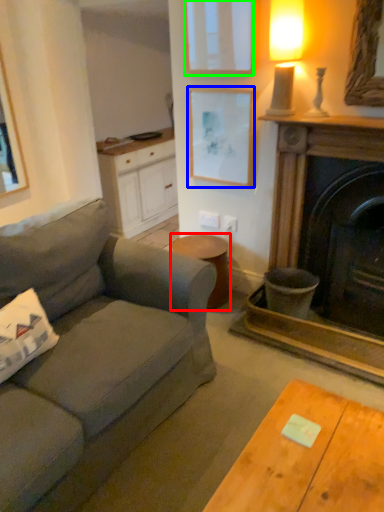
Question: Considering the real-world distances, which object is closest to stool (highlighted by a red box)? picture frame (highlighted by a blue box) or picture frame (highlighted by a green box).

Choices:
 (A) picture frame
 (B) picture frame

Answer: (A)